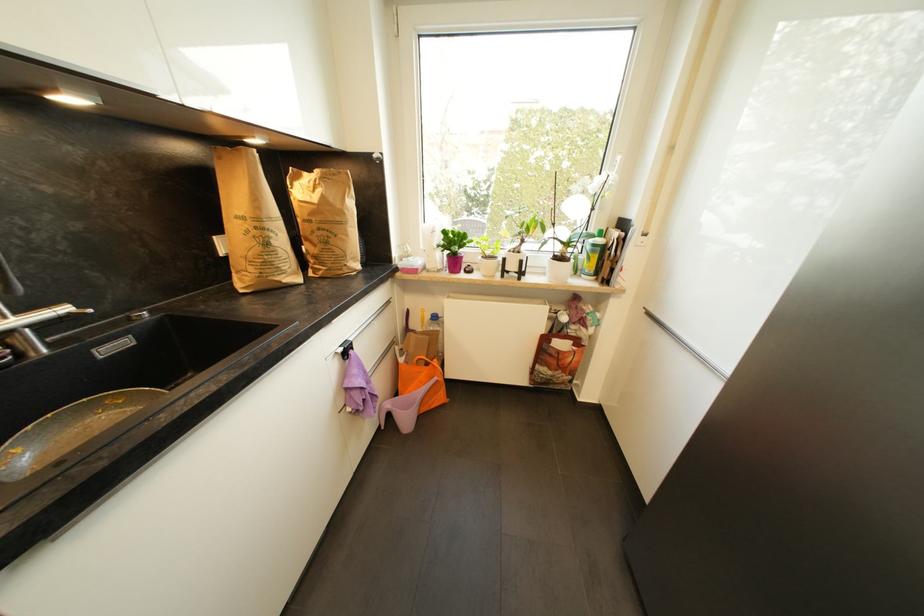
This screenshot has height=616, width=924. What do you see at coordinates (345, 349) in the screenshot?
I see `the black drawer hook` at bounding box center [345, 349].